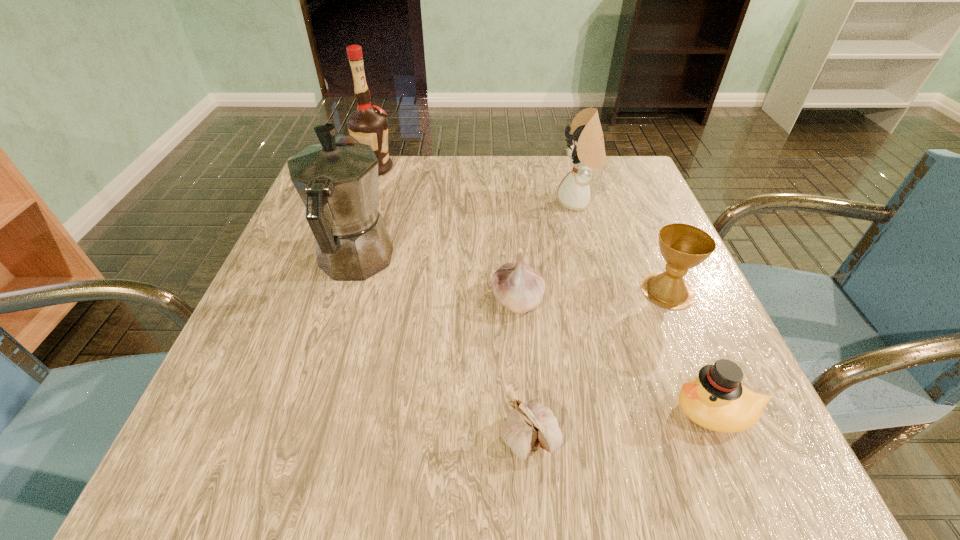
I want to click on vacant space located 0.290m on the right of the shorter garlic, so click(x=770, y=439).

You are a GUI agent. You are given a task and a screenshot of the screen. Output one action in this format:
    pyautogui.click(x=<x>, y=<y>)
    Task: Click on the liquor that is at the far edge
    The height and width of the screenshot is (540, 960).
    Given the screenshot: What is the action you would take?
    pyautogui.click(x=368, y=124)

Identify the location of doll that is at the far edge. (586, 149).

The height and width of the screenshot is (540, 960). What are the coordinates of `duck located in the near edge section of the desktop` in the screenshot? It's located at click(x=716, y=400).

Locate an element on the screen. Image resolution: width=960 pixels, height=540 pixels. garlic at the near edge is located at coordinates (528, 426).

Image resolution: width=960 pixels, height=540 pixels. I want to click on liquor at the left edge, so click(368, 124).

Locate an element on the screen. This screenshot has width=960, height=540. coffeepot located in the left edge section of the desktop is located at coordinates (337, 180).

The width and height of the screenshot is (960, 540). Find the location of `doll located in the right edge section of the desktop`. doll located in the right edge section of the desktop is located at coordinates (586, 149).

Identify the location of chalice located at the right edge. (683, 246).

Locate an element on the screen. The height and width of the screenshot is (540, 960). duck located at the right edge is located at coordinates (716, 400).